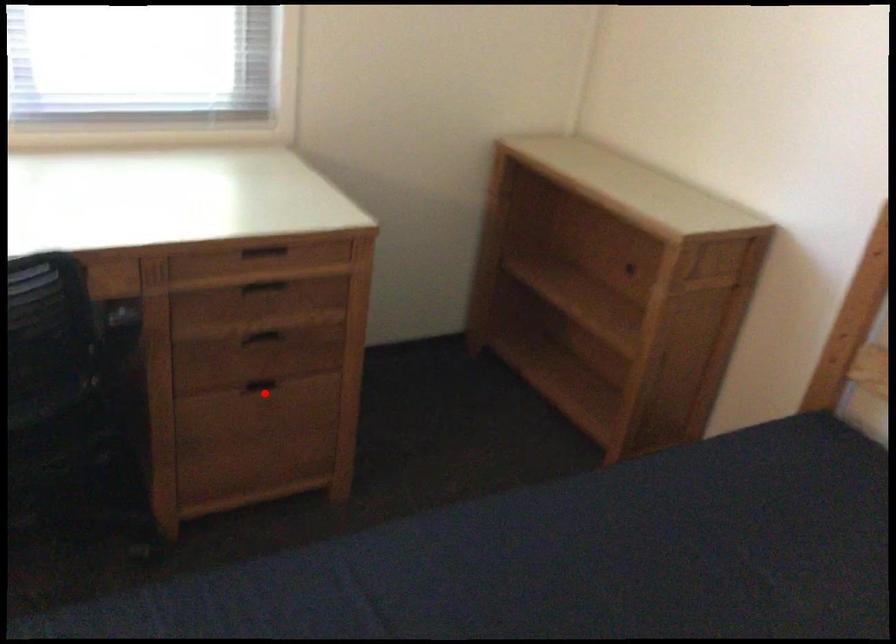
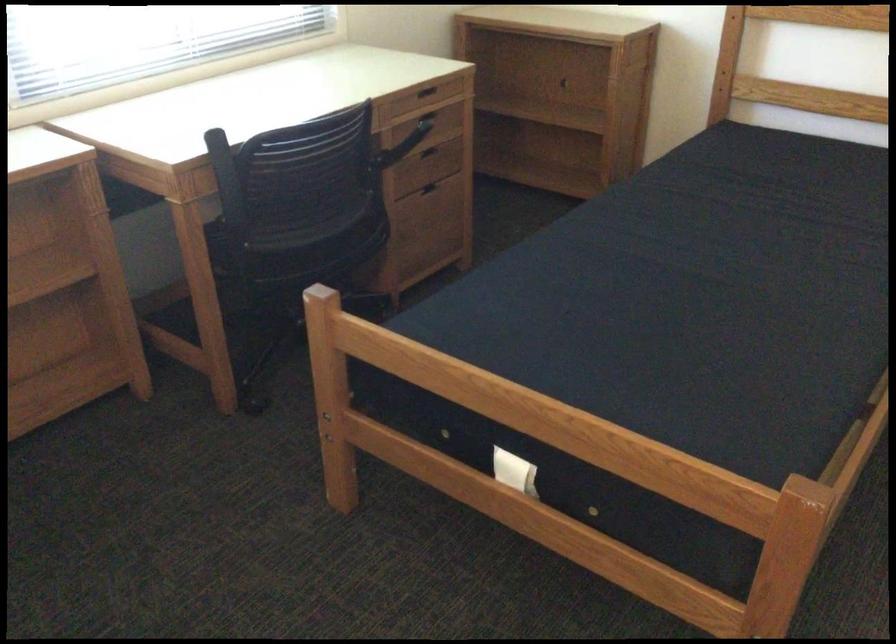
Question: A red point is marked in image1. In image2, is the corresponding 3D point closer to the camera or farther? Reply with the corresponding letter.

Choices:
 (A) The corresponding 3D point is closer.
 (B) The corresponding 3D point is farther.

Answer: (B)